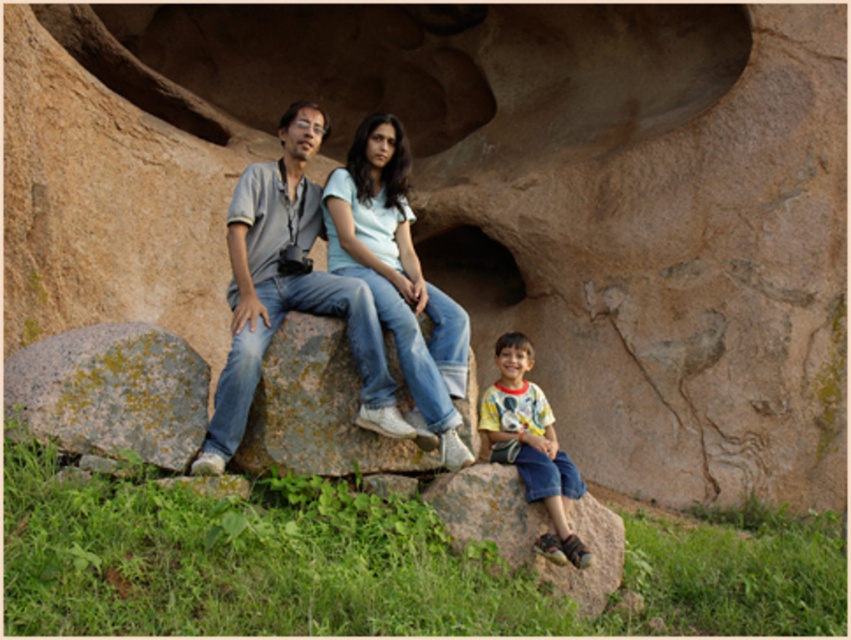
Is rusty metallic rock at center smaller than brown rough rock at lower right?

Correct, rusty metallic rock at center occupies less space than brown rough rock at lower right.

This screenshot has height=640, width=851. Describe the element at coordinates (317, 410) in the screenshot. I see `rusty metallic rock at center` at that location.

This screenshot has width=851, height=640. I want to click on rusty metallic rock at center, so click(317, 410).

Is light blue denim jeans at center behind brown rough rock at lower right?

Yes, it is behind brown rough rock at lower right.

Does point (393, 172) come closer to viewer compared to point (526, 566)?

No, (393, 172) is further to viewer.

Describe the element at coordinates (398, 276) in the screenshot. The height and width of the screenshot is (640, 851). I see `light blue denim jeans at center` at that location.

The width and height of the screenshot is (851, 640). I want to click on light blue denim jeans at center, so click(x=398, y=276).

Between brown rough rock at lower right and yellow cotton shirt at lower right, which one appears on the right side from the viewer's perspective?

Positioned to the right is yellow cotton shirt at lower right.

Who is more distant from viewer, [427,497] or [561,522]?

The point [427,497] is more distant.

Between point (460, 499) and point (567, 552), which one is positioned behind?

The point (460, 499) is behind.

Image resolution: width=851 pixels, height=640 pixels. I want to click on brown rough rock at lower right, so click(x=530, y=531).